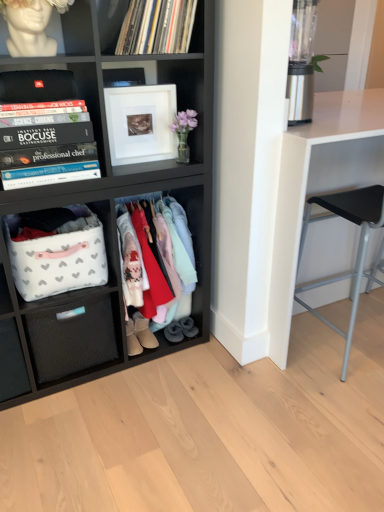
What do you see at coordinates (141, 123) in the screenshot? I see `white matte picture frame at upper center` at bounding box center [141, 123].

Measure the distance between point (83, 316) and camera.

The depth of point (83, 316) is 1.56 meters.

This screenshot has height=512, width=384. What do you see at coordinates (174, 332) in the screenshot? I see `dark gray suede slippers at lower center, which is the 2th footwear in right-to-left order` at bounding box center [174, 332].

Locate an element on the screen. The image size is (384, 512). pastel cotton clothes at center is located at coordinates (169, 261).

Considering the sizes of white matte bust at upper left, which appears as the 1th shelf when viewed from the top, and pastel cotton clothes at center in the image, is white matte bust at upper left, which appears as the 1th shelf when viewed from the top, wider or thinner than pastel cotton clothes at center?

Clearly, white matte bust at upper left, which appears as the 1th shelf when viewed from the top, has less width compared to pastel cotton clothes at center.

From the image's perspective, which is below, white matte bust at upper left, placed as the third shelf when sorted from bottom to top, or pastel cotton clothes at center?

From the image's view, pastel cotton clothes at center is below.

Based on the photo, in terms of size, does white matte bust at upper left, which appears as the 1th shelf when viewed from the top, appear bigger or smaller than pastel cotton clothes at center?

white matte bust at upper left, which appears as the 1th shelf when viewed from the top, is smaller than pastel cotton clothes at center.

Is the position of white matte bust at upper left, which appears as the 1th shelf when viewed from the top, more distant than that of pastel cotton clothes at center?

No, the depth of white matte bust at upper left, which appears as the 1th shelf when viewed from the top, is less than that of pastel cotton clothes at center.

Can you confirm if beige suede boot at lower center, which appears as the 1th footwear when viewed from the left, is positioned to the left of matte black storage unit at center, arranged as the 3th shelf when viewed from the top?

In fact, beige suede boot at lower center, which appears as the 1th footwear when viewed from the left, is to the right of matte black storage unit at center, arranged as the 3th shelf when viewed from the top.

Are beige suede boot at lower center, marked as the third footwear in a right-to-left arrangement, and matte black storage unit at center, arranged as the 3th shelf when viewed from the top, located far from each other?

They are positioned close to each other.

From a real-world perspective, which object rests below the other?

beige suede boot at lower center, which appears as the 1th footwear when viewed from the left, is physically lower.

Could matte black storage unit at center, arranged as the 3th shelf when viewed from the top, be considered to be inside beige suede boot at lower center, marked as the third footwear in a right-to-left arrangement?

No, beige suede boot at lower center, marked as the third footwear in a right-to-left arrangement, does not contain matte black storage unit at center, arranged as the 3th shelf when viewed from the top.

Is the surface of dark gray suede slippers at lower center, which is the 2th footwear from left to right, in direct contact with white matte picture frame at upper center?

No, dark gray suede slippers at lower center, which is the 2th footwear from left to right, is not next to white matte picture frame at upper center.

Which footwear is the 2nd one when counting from the back of the white matte picture frame at upper center? Please provide its 2D coordinates.

[(174, 332)]

Looking at this image, from a real-world perspective, does dark gray suede slippers at lower center, which is the 2th footwear from left to right, stand above white matte picture frame at upper center?

No, from a real-world perspective, dark gray suede slippers at lower center, which is the 2th footwear from left to right, is not over white matte picture frame at upper center

Looking at the image, does dark gray suede slippers at lower center, which is the 2th footwear from left to right, seem bigger or smaller compared to white matte picture frame at upper center?

Clearly, dark gray suede slippers at lower center, which is the 2th footwear from left to right, is smaller in size than white matte picture frame at upper center.

Considering the relative positions of gray suede boot at lower center, the third footwear from the left, and black hardcover books at left, positioned as the 2th shelf in bottom-to-top order, in the image provided, is gray suede boot at lower center, the third footwear from the left, to the left or to the right of black hardcover books at left, positioned as the 2th shelf in bottom-to-top order,?

gray suede boot at lower center, the third footwear from the left, is positioned on black hardcover books at left, positioned as the 2th shelf in bottom-to-top order,'s right side.

From the image's perspective, which footwear is the 1st one below the black hardcover books at left, which ranks as the second shelf in top-to-bottom order? Please provide its 2D coordinates.

[(188, 327)]

Is gray suede boot at lower center, the third footwear from the left, shorter than black hardcover books at left, which ranks as the second shelf in top-to-bottom order?

Yes, gray suede boot at lower center, the third footwear from the left, is shorter than black hardcover books at left, which ranks as the second shelf in top-to-bottom order.

Which object is wider, gray suede boot at lower center, which is the first footwear in right-to-left order, or black hardcover books at left, positioned as the 2th shelf in bottom-to-top order?

With larger width is black hardcover books at left, positioned as the 2th shelf in bottom-to-top order.

Is black hardcover books at left, positioned as the 2th shelf in bottom-to-top order, facing towards white matte picture frame at upper center?

No, black hardcover books at left, positioned as the 2th shelf in bottom-to-top order, does not turn towards white matte picture frame at upper center.

Does point (34, 135) appear closer or farther from the camera than point (144, 87)?

Clearly, point (34, 135) is closer to the camera than point (144, 87).

Between black hardcover books at left, positioned as the 2th shelf in bottom-to-top order, and white matte picture frame at upper center, which one has smaller width?

With smaller width is white matte picture frame at upper center.

Looking at this image, is black hardcover books at left, which ranks as the second shelf in top-to-bottom order, far from white matte picture frame at upper center?

Actually, black hardcover books at left, which ranks as the second shelf in top-to-bottom order, and white matte picture frame at upper center are a little close together.

Can you confirm if dark gray suede slippers at lower center, which is the 2th footwear in right-to-left order, is smaller than pastel cotton clothes at center?

Yes.

Find the location of a particular element. This screenshot has height=512, width=384. clothing in front of the dark gray suede slippers at lower center, which is the 2th footwear in right-to-left order is located at coordinates (169, 261).

Considering the positions of objects dark gray suede slippers at lower center, which is the 2th footwear from left to right, and pastel cotton clothes at center in the image provided, who is behind, dark gray suede slippers at lower center, which is the 2th footwear from left to right, or pastel cotton clothes at center?

Positioned behind is dark gray suede slippers at lower center, which is the 2th footwear from left to right.

Is dark gray suede slippers at lower center, which is the 2th footwear from left to right, outside of pastel cotton clothes at center?

That's incorrect, dark gray suede slippers at lower center, which is the 2th footwear from left to right, is not completely outside pastel cotton clothes at center.

Is the surface of white matte picture frame at upper center in direct contact with pastel cotton clothes at center?

No, white matte picture frame at upper center is not with pastel cotton clothes at center.

Is white matte picture frame at upper center in front of pastel cotton clothes at center?

Yes, white matte picture frame at upper center is closer to the viewer.

At what (x,y) coordinates should I click in order to perform the action: click on clothing that is behind the white matte picture frame at upper center. Please return your answer as a coordinate pair (x, y). The width and height of the screenshot is (384, 512). Looking at the image, I should click on [169, 261].

In the scene shown: Is white matte picture frame at upper center situated inside pastel cotton clothes at center or outside?

white matte picture frame at upper center cannot be found inside pastel cotton clothes at center.

From a real-world perspective, count 3rd shelfs upward from the pastel cotton clothes at center and point to it. Please provide its 2D coordinates.

[(31, 26)]

At what (x,y) coordinates should I click in order to perform the action: click on shelf that is the 3rd one when counting forward from the beige suede boot at lower center, which appears as the 1th footwear when viewed from the left. Please return your answer as a coordinate pair (x, y). This screenshot has height=512, width=384. Looking at the image, I should click on (104, 218).

Which object lies further to the anchor point matte vinyl records at upper center, black hardcover books at left, positioned as the 2th shelf in bottom-to-top order, or dark gray suede slippers at lower center, which is the 2th footwear in right-to-left order?

Based on the image, dark gray suede slippers at lower center, which is the 2th footwear in right-to-left order, appears to be further to matte vinyl records at upper center.

Looking at the image, which one is located closer to white matte bust at upper left, which appears as the 1th shelf when viewed from the top, gray suede boot at lower center, which is the first footwear in right-to-left order, or black woven drawer at lower left?

black woven drawer at lower left is closer to white matte bust at upper left, which appears as the 1th shelf when viewed from the top.

From the image, which object appears to be farther from white matte picture frame at upper center, white glossy table at right or pastel cotton clothes at center?

white glossy table at right.

From the image, which object appears to be farther from white glossy table at right, matte black storage unit at center, arranged as the 3th shelf when viewed from the top, or white matte picture frame at upper center?

The object further to white glossy table at right is white matte picture frame at upper center.

When comparing their distances from black hardcover books at left, positioned as the 2th shelf in bottom-to-top order, does beige suede boot at lower center, which appears as the 1th footwear when viewed from the left, or white glossy table at right seem further?

beige suede boot at lower center, which appears as the 1th footwear when viewed from the left, lies further to black hardcover books at left, positioned as the 2th shelf in bottom-to-top order, than the other object.

Which object lies nearer to the anchor point matte vinyl records at upper center, white fabric basket at lower left or matte black storage unit at center, the first shelf in the bottom-to-top sequence?

Based on the image, matte black storage unit at center, the first shelf in the bottom-to-top sequence, appears to be nearer to matte vinyl records at upper center.

Considering their positions, is matte black storage unit at center, arranged as the 3th shelf when viewed from the top, positioned further to black woven drawer at lower left than white matte bust at upper left, placed as the third shelf when sorted from bottom to top?

white matte bust at upper left, placed as the third shelf when sorted from bottom to top.

From the image, which object appears to be farther from pastel cotton clothes at center, white matte bust at upper left, placed as the third shelf when sorted from bottom to top, or matte vinyl records at upper center?

The object further to pastel cotton clothes at center is white matte bust at upper left, placed as the third shelf when sorted from bottom to top.

You are a GUI agent. You are given a task and a screenshot of the screen. Output one action in this format:
    pyautogui.click(x=<x>, y=<y>)
    Task: Click on the clothing between black hardcover books at left, positioned as the 2th shelf in bottom-to-top order, and black woven drawer at lower left in the up-down direction
    Image resolution: width=384 pixels, height=512 pixels.
    Given the screenshot: What is the action you would take?
    pyautogui.click(x=169, y=261)

Image resolution: width=384 pixels, height=512 pixels. I want to click on storage box between black hardcover books at left, which ranks as the second shelf in top-to-bottom order, and pastel cotton clothes at center vertically, so click(x=57, y=262).

Where is `clothing between white matte picture frame at upper center and dark gray suede slippers at lower center, which is the 2th footwear from left to right, vertically`? clothing between white matte picture frame at upper center and dark gray suede slippers at lower center, which is the 2th footwear from left to right, vertically is located at coordinates (169, 261).

You are a GUI agent. You are given a task and a screenshot of the screen. Output one action in this format:
    pyautogui.click(x=<x>, y=<y>)
    Task: Click on the clothing between matte black storage unit at center, arranged as the 3th shelf when viewed from the top, and gray suede boot at lower center, the third footwear from the left, along the z-axis
    The image size is (384, 512).
    Given the screenshot: What is the action you would take?
    pyautogui.click(x=169, y=261)